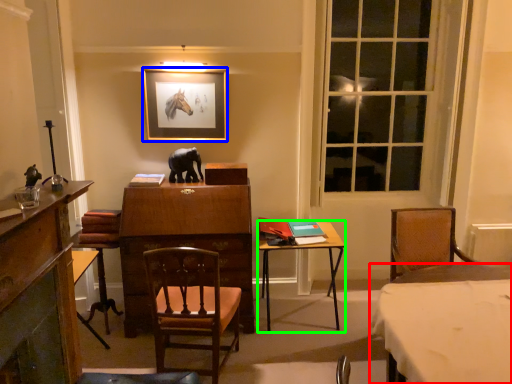
Question: Which object is positioned closest to table (highlighted by a red box)? Select from picture frame (highlighted by a blue box) and table (highlighted by a green box).

Choices:
 (A) picture frame
 (B) table

Answer: (B)